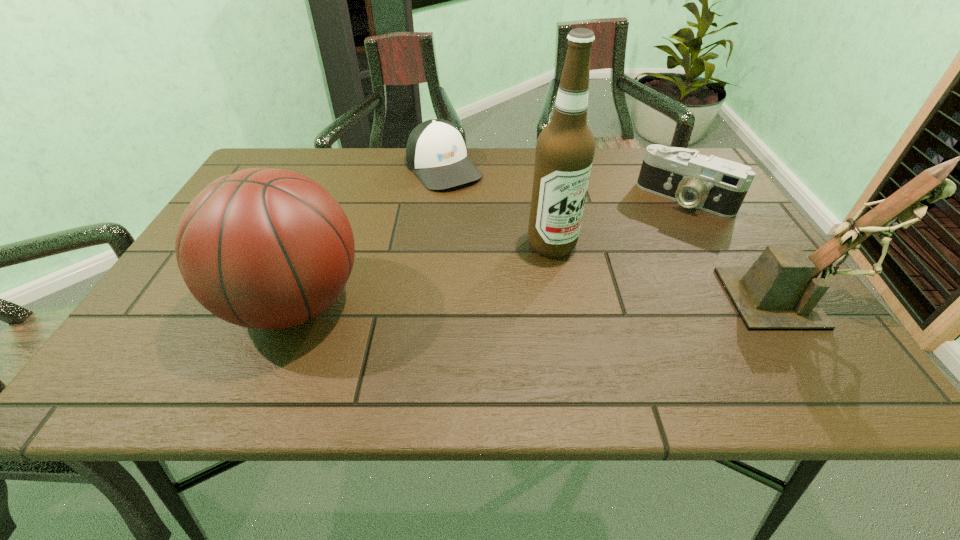
Image resolution: width=960 pixels, height=540 pixels. What are the coordinates of `vacant position located on the lens of the camera` in the screenshot? It's located at (616, 287).

Identify the location of vacant space located on the lens of the camera. The height and width of the screenshot is (540, 960). (628, 272).

I want to click on vacant region located on the lens of the camera, so click(x=645, y=248).

This screenshot has width=960, height=540. Identify the location of free space located on the label of the tallest object. (665, 336).

This screenshot has height=540, width=960. In order to click on vacant area situated 0.080m on the label of the tallest object in this screenshot , I will do `click(594, 279)`.

Find the location of `vacant space situated 0.120m on the label of the tallest object`. vacant space situated 0.120m on the label of the tallest object is located at coordinates (608, 289).

Where is `cap at the far edge`? The height and width of the screenshot is (540, 960). cap at the far edge is located at coordinates (436, 152).

This screenshot has height=540, width=960. What are the coordinates of `camera that is at the far edge` in the screenshot? It's located at (715, 185).

Where is `basketball at the near edge`? The width and height of the screenshot is (960, 540). basketball at the near edge is located at coordinates (264, 248).

At what (x,y) coordinates should I click in order to perform the action: click on figurine that is at the near edge. Please return your answer as a coordinate pair (x, y). Image resolution: width=960 pixels, height=540 pixels. Looking at the image, I should click on (781, 290).